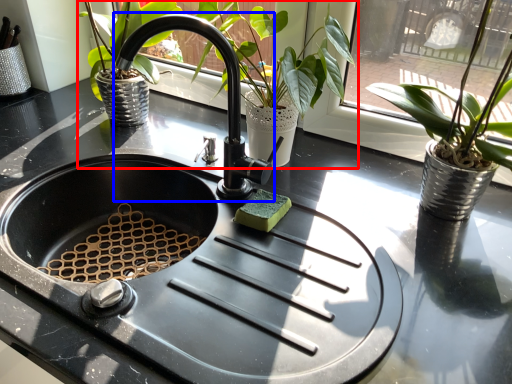
Question: Among these objects, which one is nearest to the camera, houseplant (highlighted by a red box) or faucet (highlighted by a blue box)?

Choices:
 (A) houseplant
 (B) faucet

Answer: (B)